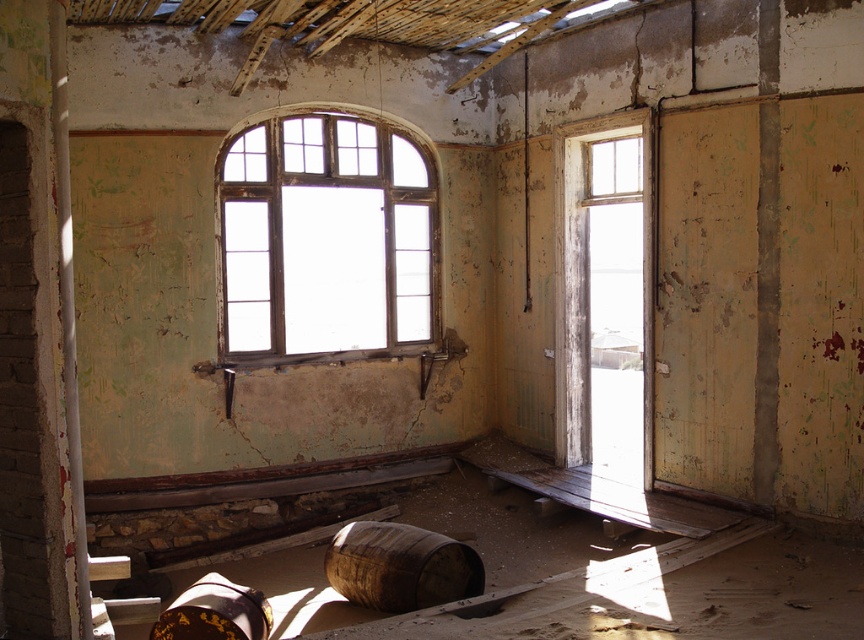
Is point (399, 600) behind point (248, 604)?

Yes, it is behind point (248, 604).

Which is in front, point (341, 568) or point (217, 577)?

Point (217, 577) is more forward.

Identify the location of brown wooden barrel at center. This screenshot has width=864, height=640. (399, 566).

Does wooden frame window at center appear on the right side of white painted wood at left?

Yes, wooden frame window at center is to the right of white painted wood at left.

What are the coordinates of `wooden frame window at center` in the screenshot? It's located at [x=325, y=240].

The height and width of the screenshot is (640, 864). I want to click on wooden frame window at center, so click(325, 240).

Is white painted wood at left thinner than brown wooden barrel at lower center?

Yes, white painted wood at left is thinner than brown wooden barrel at lower center.

Is white painted wood at left wider than brown wooden barrel at lower center?

Incorrect, white painted wood at left's width does not surpass brown wooden barrel at lower center's.

Is point (68, 272) farther from camera compared to point (210, 618)?

No.

Locate an element on the screen. This screenshot has width=864, height=640. white painted wood at left is located at coordinates (67, 304).